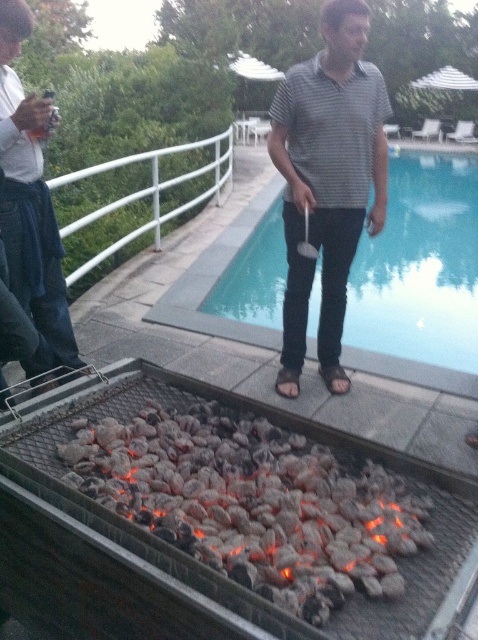
Question: Does gray striped shirt at center have a smaller size compared to brushed metal water at bottle left?

Choices:
 (A) yes
 (B) no

Answer: (A)

Question: Which of these objects is positioned farthest from the brushed metal water at bottle left?

Choices:
 (A) charcoal at lower center
 (B) gray striped shirt at center

Answer: (B)

Question: Does blue glass swimming pool at center appear over gray striped shirt at center?

Choices:
 (A) no
 (B) yes

Answer: (B)

Question: Which point appears closest to the camera in this image?

Choices:
 (A) (228, 280)
 (B) (362, 568)

Answer: (B)

Question: Can you confirm if blue glass swimming pool at center is positioned to the left of brushed metal water at bottle left?

Choices:
 (A) no
 (B) yes

Answer: (A)

Question: Which object is closer to the camera taking this photo?

Choices:
 (A) charcoal at lower center
 (B) brushed metal water at bottle left

Answer: (A)